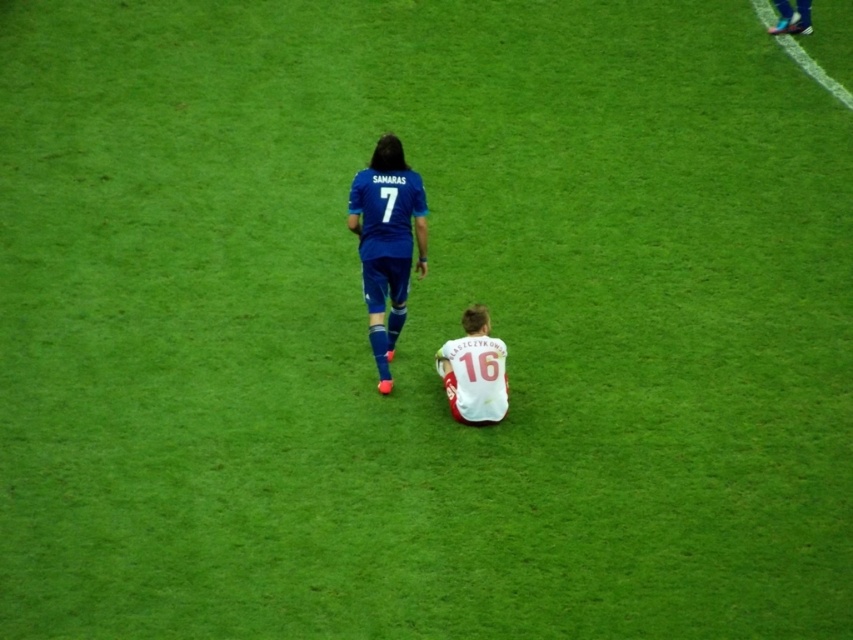
You are a soccer coach observing the game. You notice the blue matte soccer player at upper center and the white jersey at center. Which player appears closer to the camera based on their size?

The blue matte soccer player at upper center appears closer to the camera because it is larger in size than the white jersey at center.

You are a soccer player positioned at point (376, 195) and need to pass the ball to your teammate at point (508, 385). Considering the positions of the two players in the scene, which player is closer to your passing path?

The seated player in white jersey with red accents and number 16 is closer to your passing path because point (376, 195) is further to the camera than point (508, 385), meaning the path from your position to the teammate passes near the seated player.